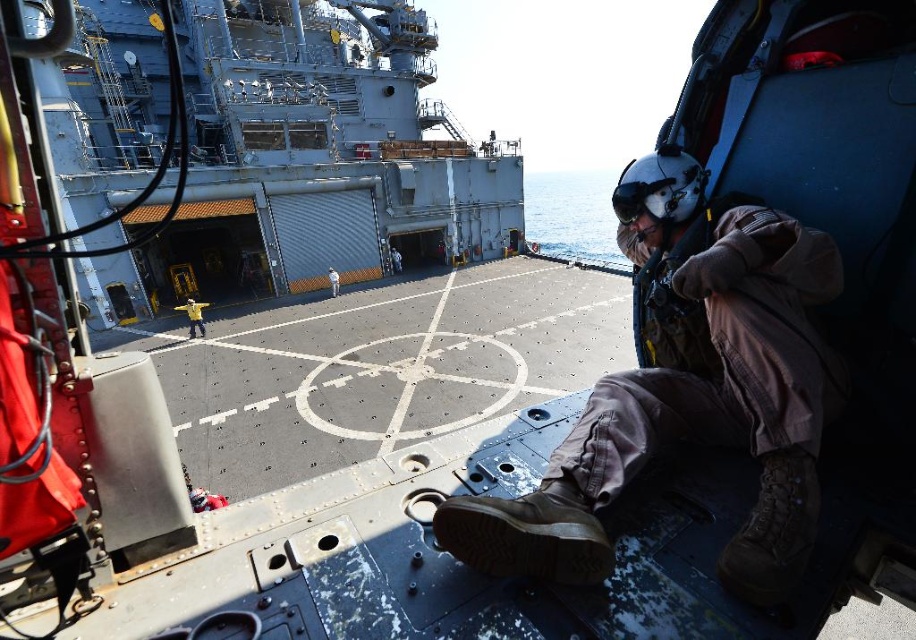
Question: Which object appears closest to the camera in this image?

Choices:
 (A) black matte helmet at upper right
 (B) light blue uniform at center

Answer: (A)

Question: Can you confirm if yellow fabric at center is thinner than light blue uniform at center?

Choices:
 (A) no
 (B) yes

Answer: (A)

Question: Observing the image, what is the correct spatial positioning of brown fabric helmet at upper center in reference to yellow fabric at center?

Choices:
 (A) above
 (B) below

Answer: (B)

Question: Is black matte helmet at upper right behind yellow fabric at center?

Choices:
 (A) yes
 (B) no

Answer: (B)

Question: Which of the following is the closest to the observer?

Choices:
 (A) (657, 212)
 (B) (202, 304)

Answer: (A)

Question: Which object is positioned farthest from the gray metallic boat at center?

Choices:
 (A) black matte helmet at upper right
 (B) light blue uniform at center
 (C) brown fabric helmet at upper center

Answer: (C)